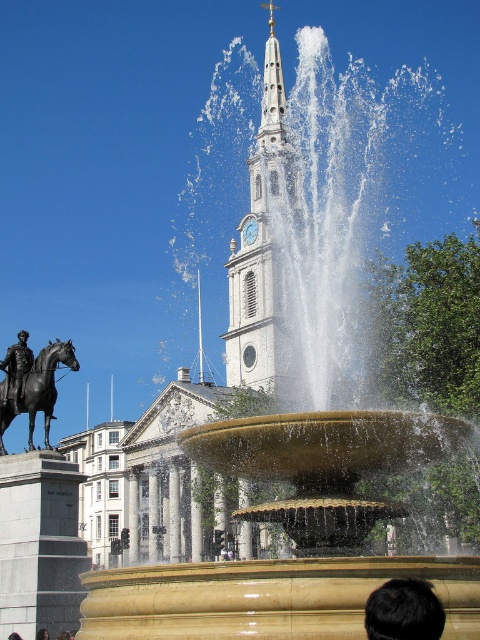
Is polished bronze horse at center-left bigger than polished bronze statue at left?

Indeed, polished bronze horse at center-left has a larger size compared to polished bronze statue at left.

Is point (10, 410) farther from viewer compared to point (2, 364)?

No, it is not.

Is point (0, 422) farther from camera compared to point (13, 390)?

Yes, point (0, 422) is behind point (13, 390).

At what (x,y) coordinates should I click in order to perform the action: click on polished bronze horse at center-left. Please return your answer as a coordinate pair (x, y). This screenshot has height=640, width=480. Looking at the image, I should click on (44, 385).

Does white stone clock tower at center appear over polished bronze statue at left?

Correct, white stone clock tower at center is located above polished bronze statue at left.

From the picture: Who is more forward, (259, 141) or (15, 384)?

Point (15, 384) is more forward.

Between point (277, 93) and point (3, 369), which one is positioned behind?

The point (277, 93) is behind.

Where is `white stone clock tower at center`? white stone clock tower at center is located at coordinates (264, 250).

Does black hair at lower center appear on the left side of polished bronze statue at left?

No, black hair at lower center is not to the left of polished bronze statue at left.

Is black hair at lower center closer to camera compared to polished bronze statue at left?

Yes, it is.

Is point (437, 621) positioned after point (16, 380)?

No, (437, 621) is in front of (16, 380).

Locate an element on the screen. black hair at lower center is located at coordinates (404, 611).